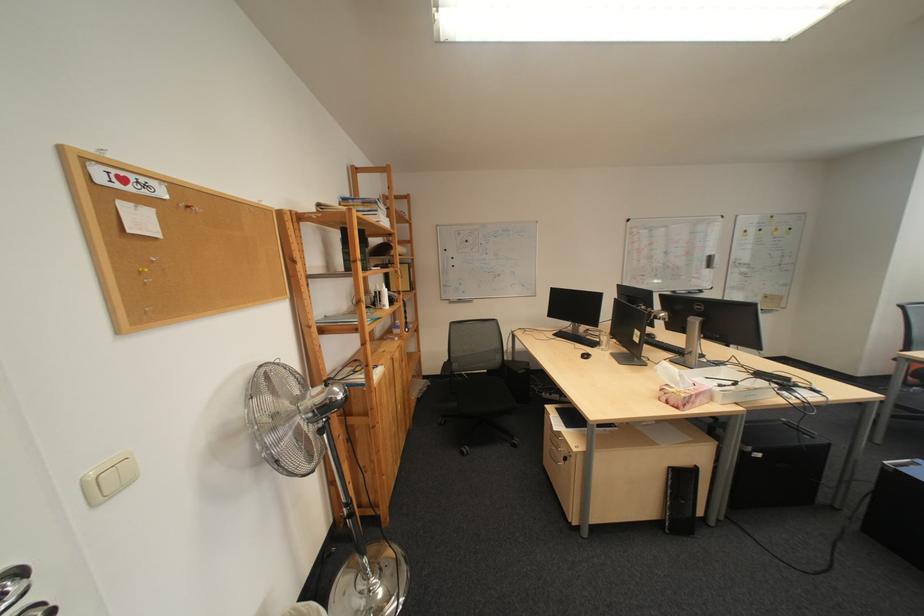
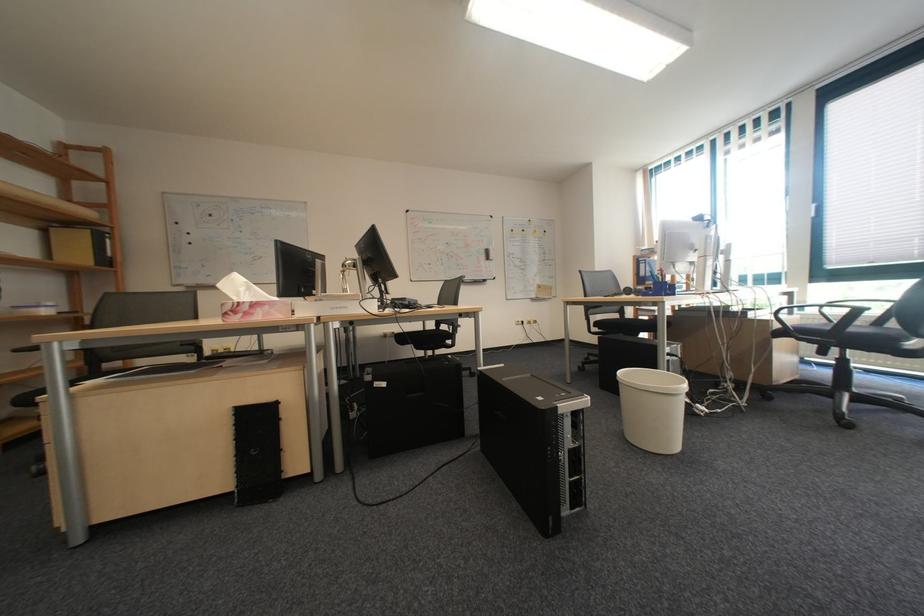
The point at (515, 276) is marked in the first image. Where is the corresponding point in the second image?

(275, 257)